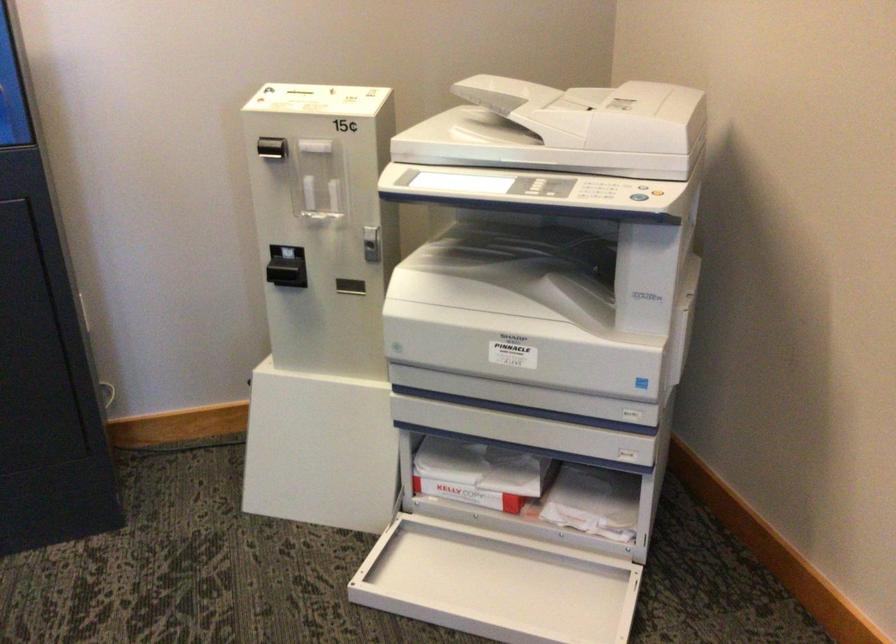
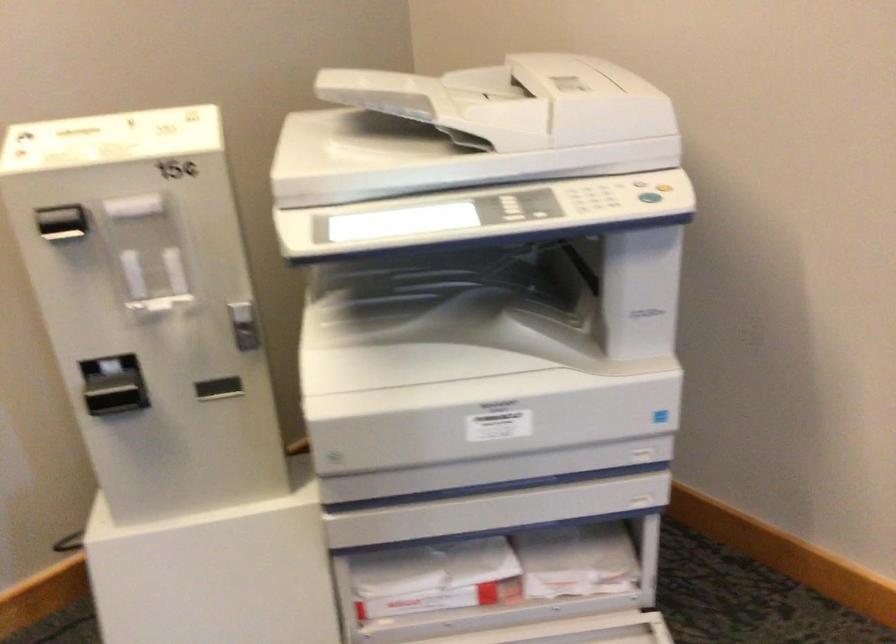
Find the pixel in the second image that matches (x=268, y=149) in the first image.

(62, 223)